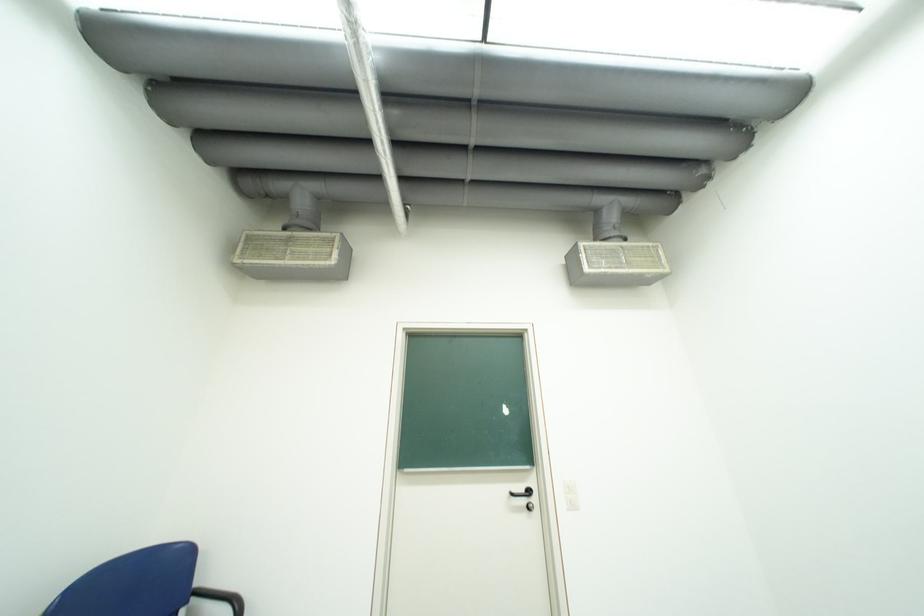
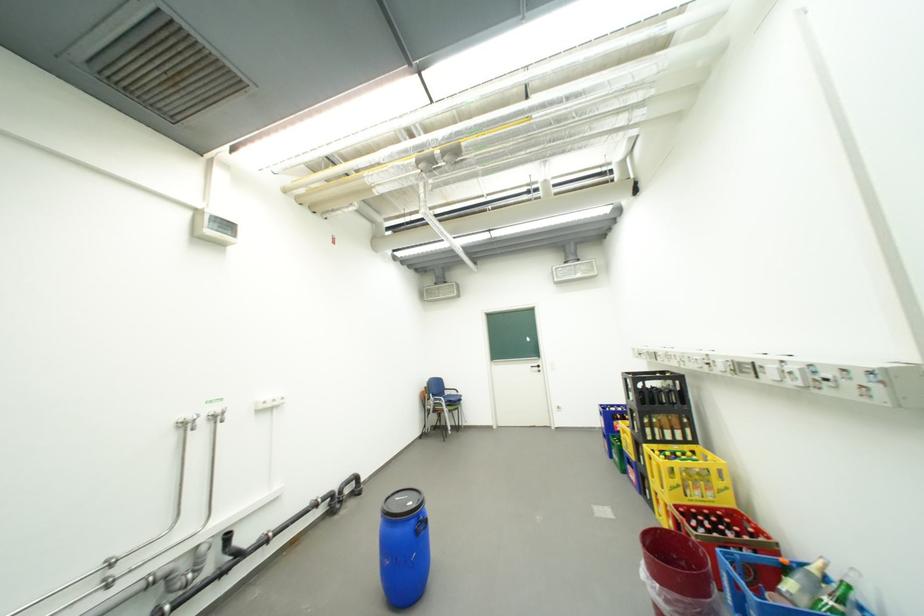
Question: What movement of the cameraman would produce the second image?

Choices:
 (A) Left
 (B) Right
 (C) Forward
 (D) Backward

Answer: (D)